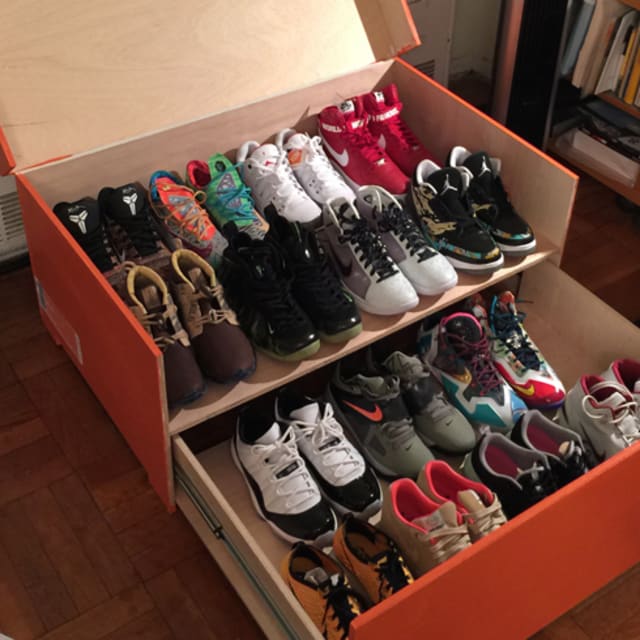
The image size is (640, 640). What are the coordinates of `air vent` in the screenshot? It's located at (13, 228).